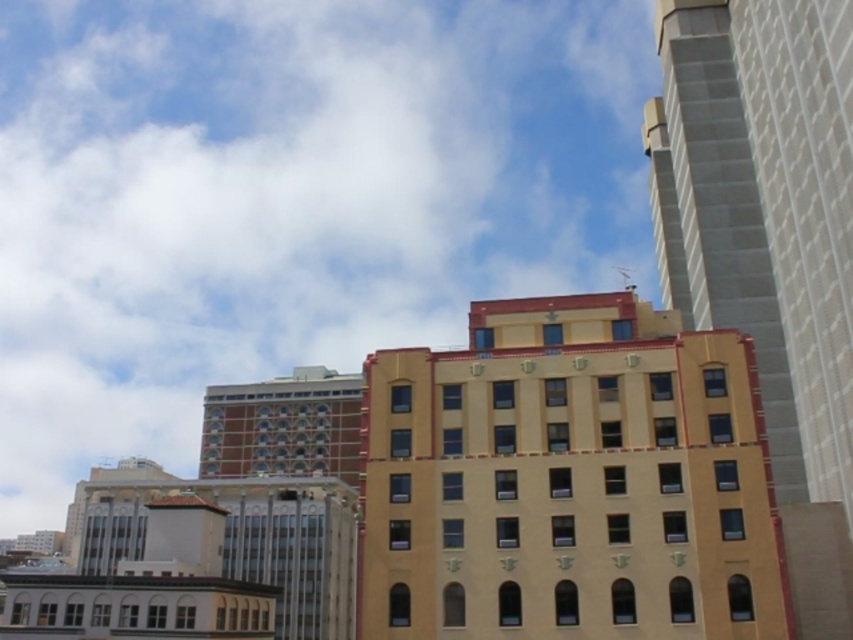
Question: Can you confirm if yellow matte building at center is thinner than smooth concrete skyscraper at right?

Choices:
 (A) yes
 (B) no

Answer: (B)

Question: Which object appears closest to the camera in this image?

Choices:
 (A) smooth concrete skyscraper at right
 (B) yellow matte building at center

Answer: (B)

Question: Does yellow matte building at center have a larger size compared to smooth concrete skyscraper at right?

Choices:
 (A) no
 (B) yes

Answer: (A)

Question: Which point is closer to the camera?

Choices:
 (A) yellow matte building at center
 (B) smooth concrete skyscraper at right

Answer: (A)

Question: Can you confirm if yellow matte building at center is thinner than smooth concrete skyscraper at right?

Choices:
 (A) yes
 (B) no

Answer: (B)